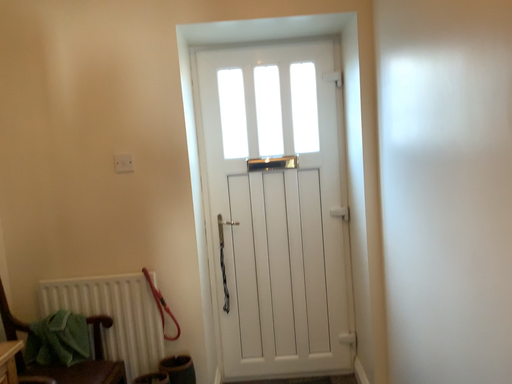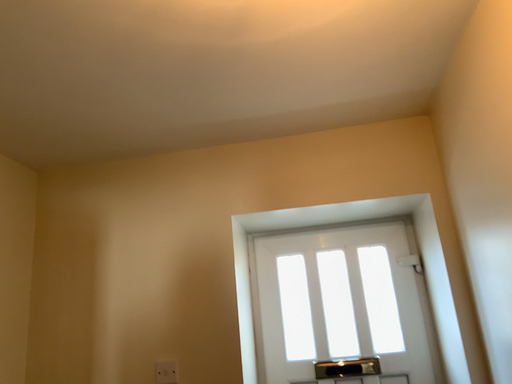
Question: How did the camera likely rotate when shooting the video?

Choices:
 (A) rotated left
 (B) rotated right

Answer: (A)